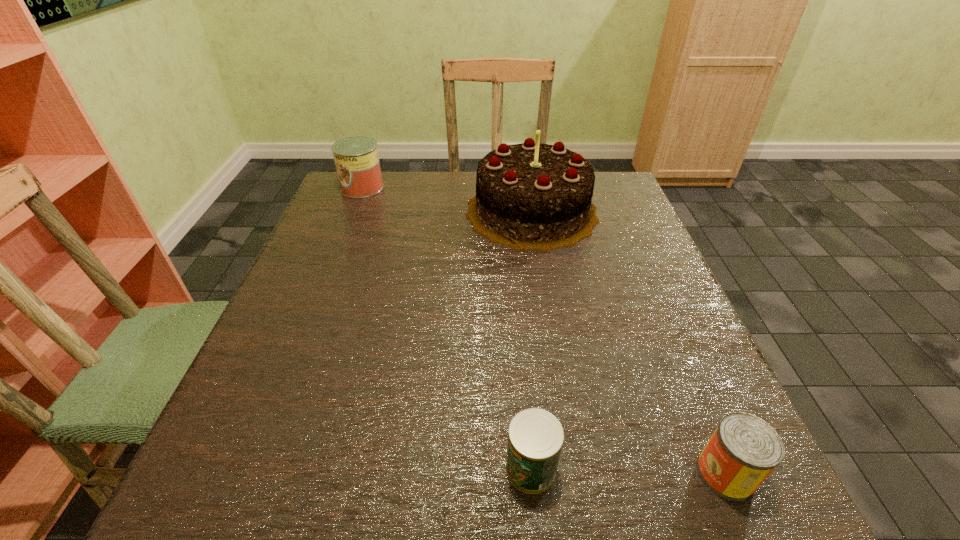
The image size is (960, 540). Find the location of `can that is at the far edge`. can that is at the far edge is located at coordinates (356, 158).

Image resolution: width=960 pixels, height=540 pixels. In order to click on object at the left edge in this screenshot , I will do `click(356, 158)`.

This screenshot has width=960, height=540. What are the coordinates of `birthday cake at the right edge` in the screenshot? It's located at (529, 196).

This screenshot has height=540, width=960. In order to click on can that is at the right edge in this screenshot , I will do `click(744, 449)`.

Locate an element on the screen. object that is positioned at the far left corner is located at coordinates (356, 158).

Locate an element on the screen. The width and height of the screenshot is (960, 540). object positioned at the far right corner is located at coordinates (529, 196).

At what (x,y) coordinates should I click in order to perform the action: click on object located in the near right corner section of the desktop. Please return your answer as a coordinate pair (x, y). Looking at the image, I should click on (744, 449).

In the image, there is a desktop. Where is `vacant space at the far edge`? The height and width of the screenshot is (540, 960). vacant space at the far edge is located at coordinates [450, 172].

At what (x,y) coordinates should I click in order to perform the action: click on vacant space at the near edge of the desktop. Please return your answer as a coordinate pair (x, y). Looking at the image, I should click on click(x=452, y=494).

This screenshot has height=540, width=960. In the image, there is a desktop. Identify the location of blank space at the left edge. (311, 398).